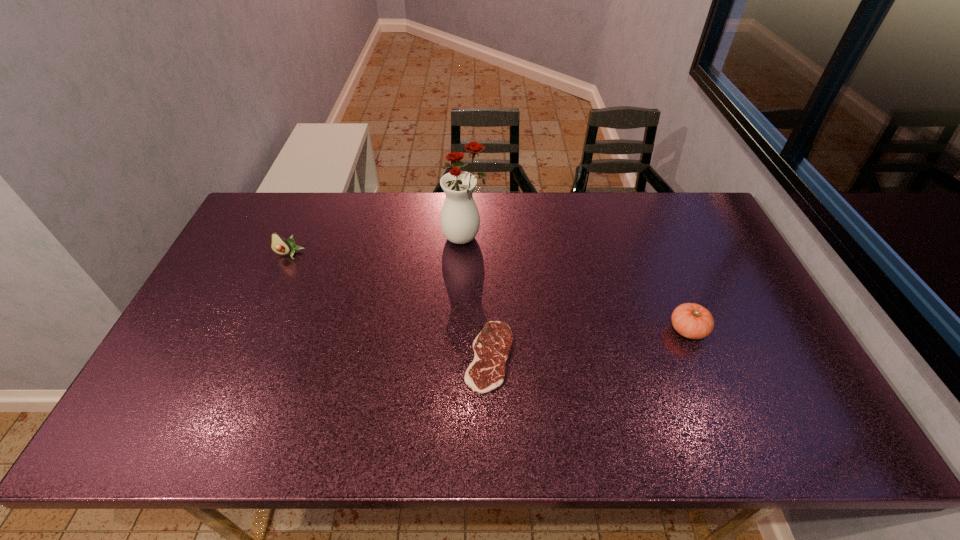
The width and height of the screenshot is (960, 540). In order to click on object located at the far edge in this screenshot , I will do `click(460, 220)`.

Locate an element on the screen. This screenshot has width=960, height=540. object at the left edge is located at coordinates (279, 245).

In the image, there is a desktop. At what (x,y) coordinates should I click in order to perform the action: click on free space at the far edge. Please return your answer as a coordinate pair (x, y). The height and width of the screenshot is (540, 960). Looking at the image, I should click on (348, 198).

In order to click on vacant region at the near edge of the desktop in this screenshot , I will do `click(615, 428)`.

Locate an element on the screen. This screenshot has width=960, height=540. free space at the left edge is located at coordinates (169, 389).

The image size is (960, 540). What are the coordinates of `vacant space at the right edge of the desktop` in the screenshot? It's located at (706, 257).

Locate an element on the screen. vacant space at the far left corner is located at coordinates (278, 221).

The image size is (960, 540). I want to click on free space between the avocado and the tallest object, so click(377, 246).

The image size is (960, 540). I want to click on empty space that is in between the third tallest object and the avocado, so click(489, 292).

The image size is (960, 540). I want to click on vacant space that's between the tallest object and the tomato, so click(576, 284).